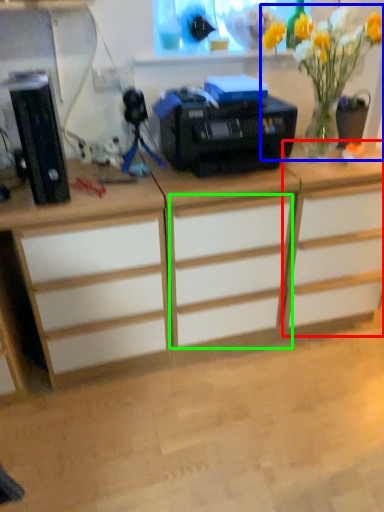
Question: Considering the real-world distances, which object is farthest from cabinetry (highlighted by a red box)? floral arrangement (highlighted by a blue box) or drawer (highlighted by a green box)?

Choices:
 (A) floral arrangement
 (B) drawer

Answer: (A)